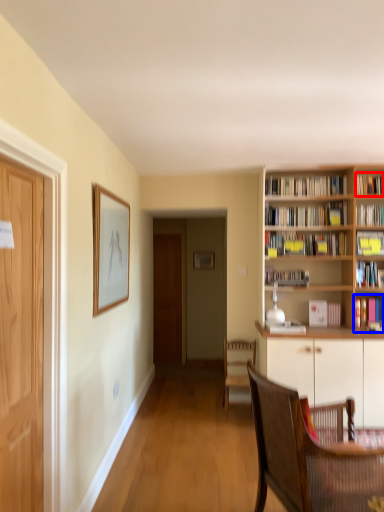
Question: Among these objects, which one is farthest to the camera, book (highlighted by a red box) or book (highlighted by a blue box)?

Choices:
 (A) book
 (B) book

Answer: (A)